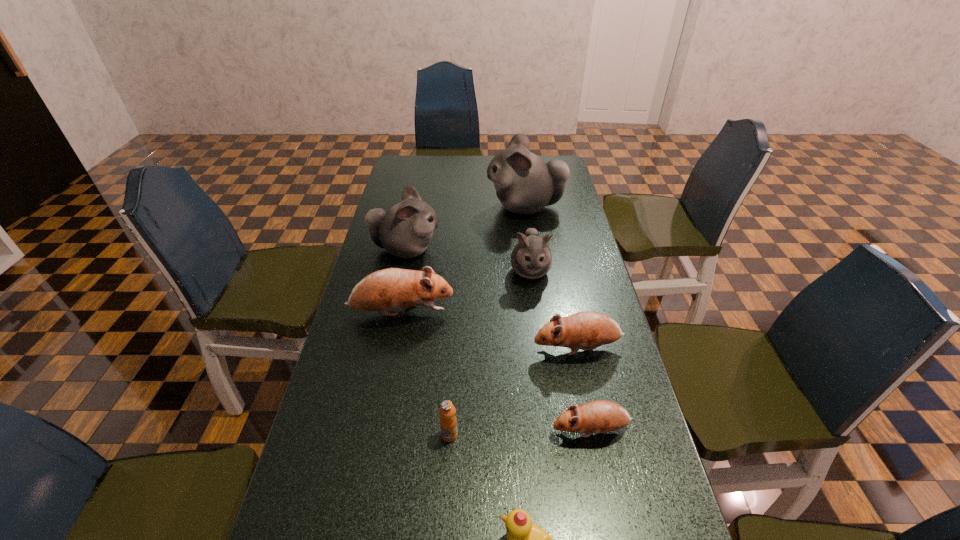
This screenshot has height=540, width=960. What are the coordinates of `the fourth closest hamster to the second smallest brown hamster` in the screenshot? It's located at click(405, 230).

Choose which white hamster is the third nearest neighbor to the orange juice. Please provide its 2D coordinates. Your answer should be formatted as a tuple, i.e. [(x, y)], where the tuple contains the x and y coordinates of a point satisfying the conditions above.

[(525, 184)]

Identify which white hamster is the second nearest to the leftmost white hamster. Please provide its 2D coordinates. Your answer should be formatted as a tuple, i.e. [(x, y)], where the tuple contains the x and y coordinates of a point satisfying the conditions above.

[(531, 258)]

Where is `brown hamster that stands as the second closest to the third nearest hamster`? The image size is (960, 540). brown hamster that stands as the second closest to the third nearest hamster is located at coordinates (600, 416).

Choose which brown hamster is the second nearest neighbor to the farthest object. Please provide its 2D coordinates. Your answer should be formatted as a tuple, i.e. [(x, y)], where the tuple contains the x and y coordinates of a point satisfying the conditions above.

[(587, 330)]

Find the location of a particular element. vacant space that satisfies the following two spatial constraints: 1. on the face of the tallest hamster; 2. on the face of the smallest white hamster is located at coordinates (535, 271).